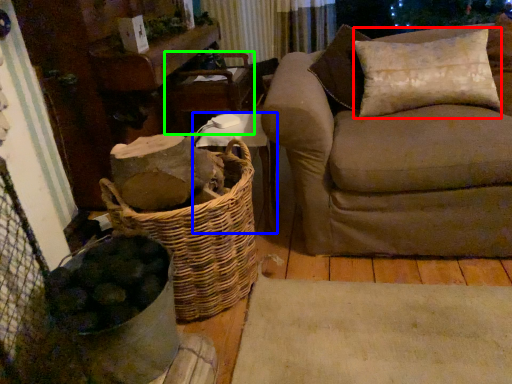
Question: Which object is the closest to the pillow (highlighted by a red box)? Choose among these: furniture (highlighted by a blue box) or armchair (highlighted by a green box).

Choices:
 (A) furniture
 (B) armchair

Answer: (A)